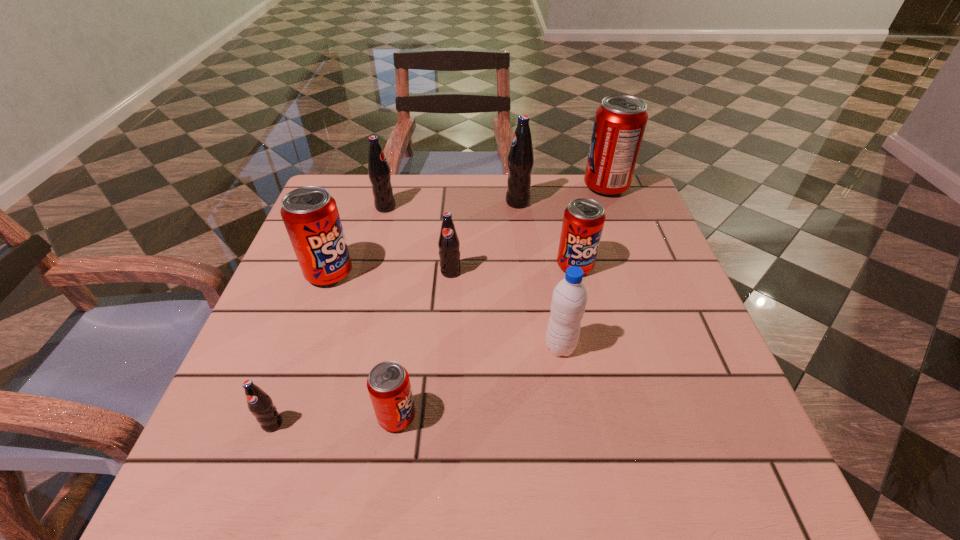
At what (x,y) coordinates should I click in order to perform the action: click on empty space between the rightmost black pop and the leftmost black pop. Please return your answer as a coordinate pair (x, y). This screenshot has height=540, width=960. Looking at the image, I should click on [396, 313].

Find the location of `vacant space that's between the second smallest red soda can and the sixth object from right to left`. vacant space that's between the second smallest red soda can and the sixth object from right to left is located at coordinates (486, 341).

The height and width of the screenshot is (540, 960). Identify the location of free space between the second biggest red soda can and the rightmost black pop. (423, 238).

Where is `vacant area that lies between the second biggest red soda can and the biggest black pop`? vacant area that lies between the second biggest red soda can and the biggest black pop is located at coordinates (423, 238).

The width and height of the screenshot is (960, 540). Find the location of `vacant region between the third red soda can from left to right and the sixth soda can from left to right`. vacant region between the third red soda can from left to right and the sixth soda can from left to right is located at coordinates (546, 234).

Find the location of a particular element. vacant region between the rightmost black pop and the sixth object from right to left is located at coordinates (457, 309).

Where is `free space between the nearest black pop and the sixth object from right to left`? The width and height of the screenshot is (960, 540). free space between the nearest black pop and the sixth object from right to left is located at coordinates (335, 420).

Select which object appears as the seventh closest to the fifth soda can from left to right. Please provide its 2D coordinates. Your answer should be formatted as a tuple, i.e. [(x, y)], where the tuple contains the x and y coordinates of a point satisfying the conditions above.

[(260, 404)]

Select which object is the fifth closest to the water bottle. Please provide its 2D coordinates. Your answer should be formatted as a tuple, i.e. [(x, y)], where the tuple contains the x and y coordinates of a point satisfying the conditions above.

[(310, 215)]

Where is `soda can that is the second closest to the leftmost red soda can`? The width and height of the screenshot is (960, 540). soda can that is the second closest to the leftmost red soda can is located at coordinates (448, 243).